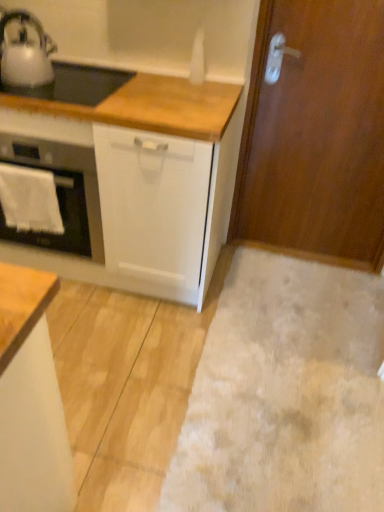
The height and width of the screenshot is (512, 384). In order to click on free space above beige carpet at lower right (from a real-world perspective) in this screenshot , I will do `click(301, 371)`.